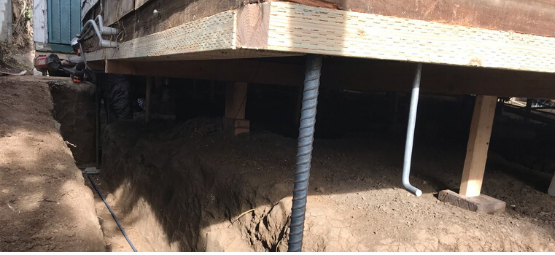
Find the location of `blue cord`. blue cord is located at coordinates (124, 235).